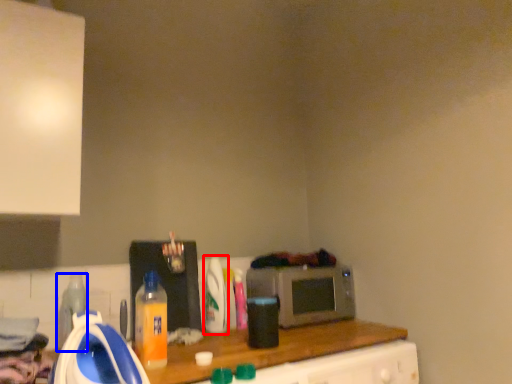
Question: Which of the following is the farthest to the observer, bottle (highlighted by a red box) or bottle (highlighted by a blue box)?

Choices:
 (A) bottle
 (B) bottle

Answer: (A)